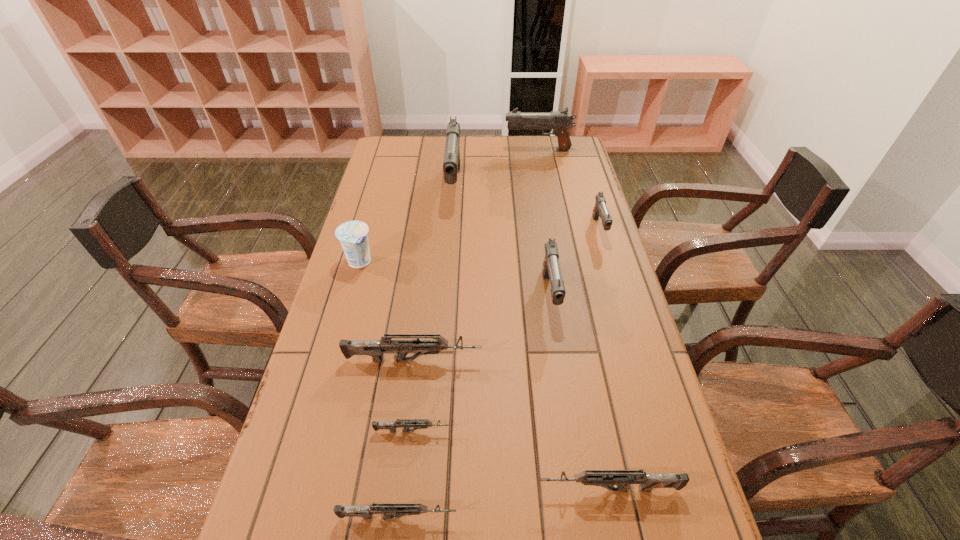
This screenshot has width=960, height=540. What are the coordinates of `free region located 0.110m in the direction the farthest object is aimed` in the screenshot? It's located at (477, 150).

Where is `vacant region located in the direction the second smallest gray gun is aimed`? vacant region located in the direction the second smallest gray gun is aimed is located at coordinates (x=561, y=366).

This screenshot has height=540, width=960. What are the coordinates of `vacant space located 0.270m on the front of the yogurt` in the screenshot? It's located at (334, 353).

You are a GUI agent. You are given a task and a screenshot of the screen. Output one action in this format:
    pyautogui.click(x=<x>, y=<y>)
    Task: Click on the vacant area located 0.180m in the direction the third farthest object is aimed
    This screenshot has width=960, height=540.
    Given the screenshot: What is the action you would take?
    pyautogui.click(x=616, y=288)

The image size is (960, 540). In order to click on vacant space located 0.320m aimed along the barrel of the fifth farthest gun in this screenshot , I will do `click(615, 361)`.

Where is `free space located 0.340m aimed along the barrel of the eighth farthest object`? Image resolution: width=960 pixels, height=540 pixels. free space located 0.340m aimed along the barrel of the eighth farthest object is located at coordinates (361, 490).

The image size is (960, 540). Identify the location of vacant area situated 0.200m aimed along the barrel of the eighth farthest object. (434, 490).

I want to click on vacant space situated 0.240m aimed along the barrel of the eighth farthest object, so [413, 490].

This screenshot has width=960, height=540. In order to click on blank space located 0.340m aimed along the barrel of the second shortest gun in this screenshot , I will do `click(642, 517)`.

Identify the location of vacant space located 0.340m aimed along the barrel of the shortest object. The height and width of the screenshot is (540, 960). (613, 431).